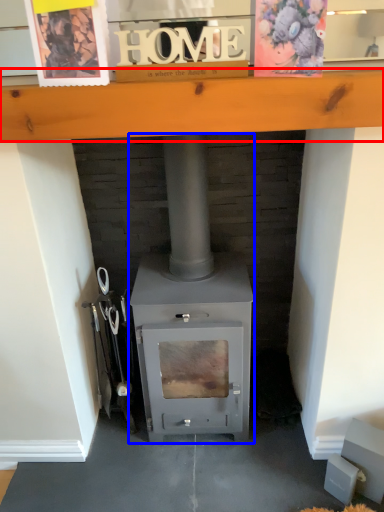
Question: Which point is closer to the camera, ledge (highlighted by a red box) or wood burning stove (highlighted by a blue box)?

Choices:
 (A) ledge
 (B) wood burning stove

Answer: (A)